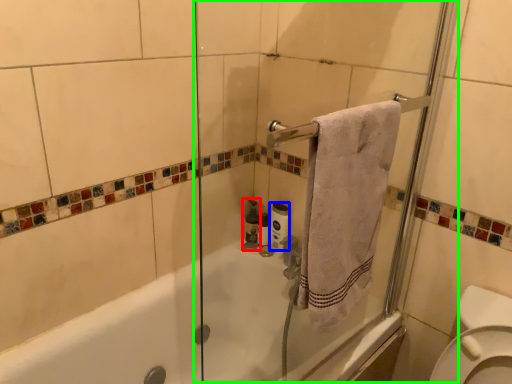
Question: Based on their relative distances, which object is nearer to toiletry (highlighted by a red box)? Choose from toilet paper (highlighted by a blue box) and screen door (highlighted by a green box).

Choices:
 (A) toilet paper
 (B) screen door

Answer: (B)